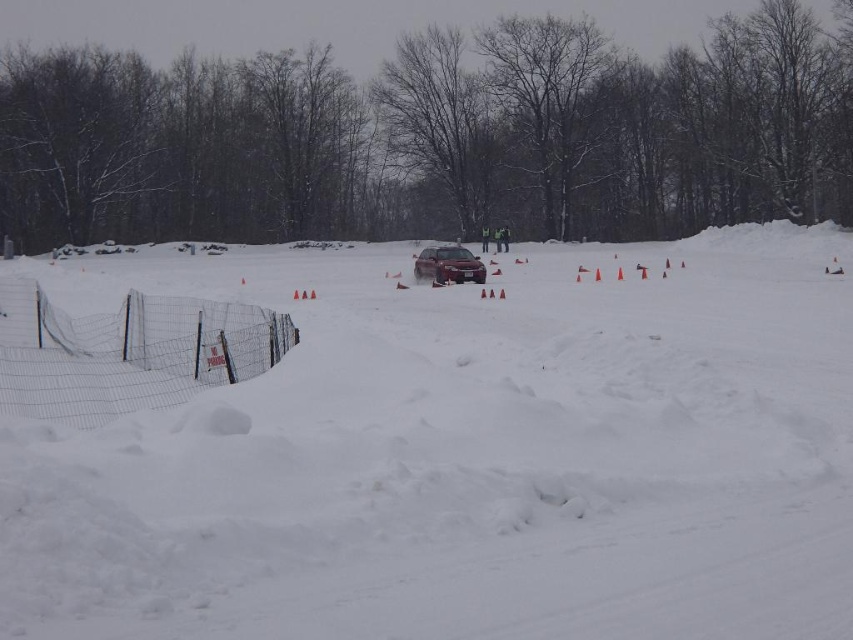
You are standing at the starting line of the driving course and see the point marked at coordinates point (312, 536). If you need to reach a point that is exactly 8 meters away from you, is the marked point closer or farther than that target distance?

The distance of point (312, 536) from viewer is 7.65 meters, which is closer than 8 meters. Therefore, the marked point is closer than the target distance of 8 meters.

You are a driver taking a snow driving course. You see the white fluffy snow at center and the satin silver sedan at center. Which object is closer to you?

The white fluffy snow at center is closer to the viewer than the satin silver sedan at center.

You are a delivery driver who needs to park your truck near the wire mesh fence at lower left. However, there is a NO PARKING sign on it. Can you park your truck on the white fluffy snow at center instead?

The white fluffy snow at center might be wider than wire mesh fence at lower left, so it could provide enough space for parking. However, the NO PARKING sign on the wire mesh fence at lower left prohibits parking there, so you should park on the white fluffy snow at center if it is safe and legal to do so.